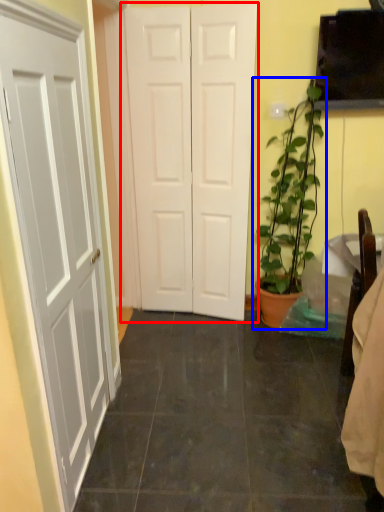
Question: Among these objects, which one is nearest to the camera, door (highlighted by a red box) or houseplant (highlighted by a blue box)?

Choices:
 (A) door
 (B) houseplant

Answer: (B)